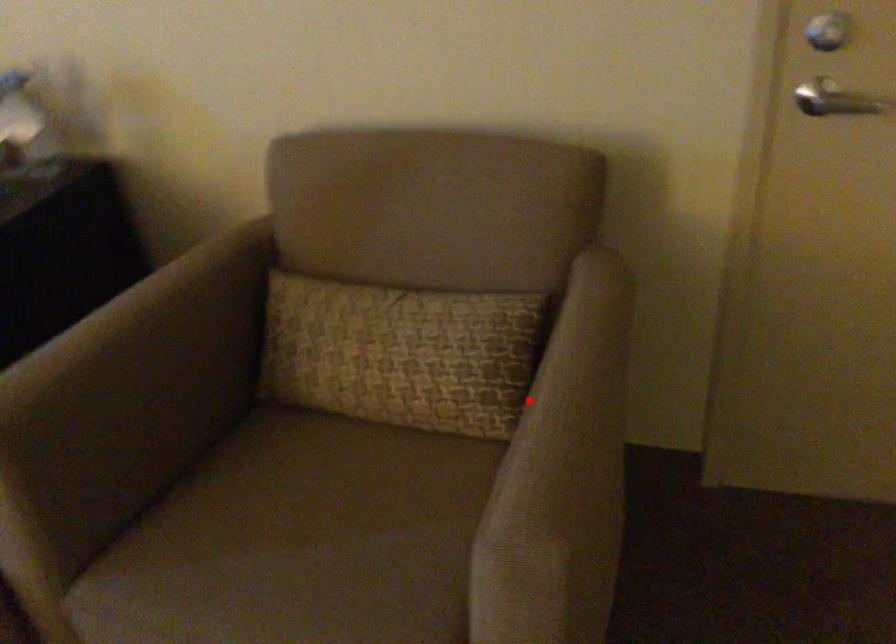
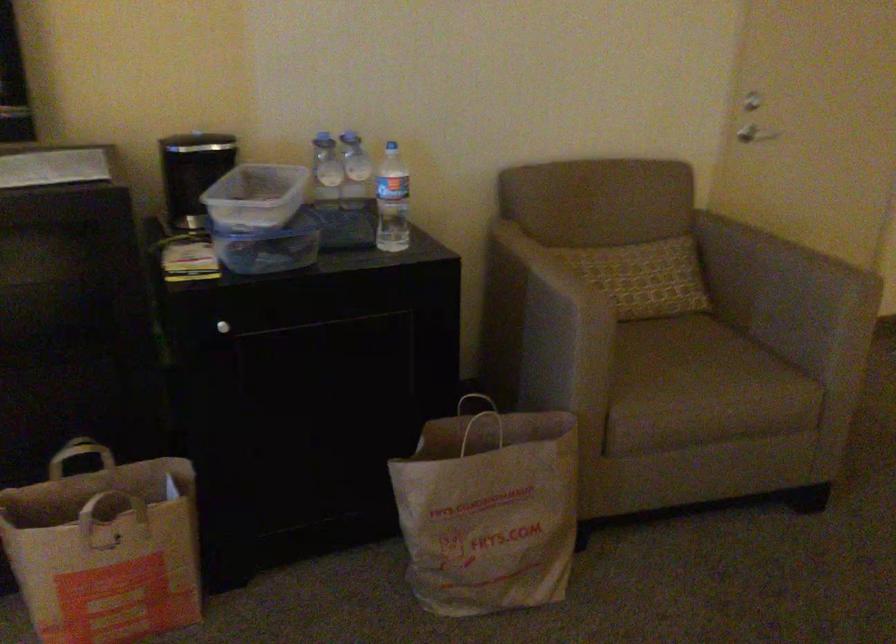
Question: I am providing you with two images of the same scene from different viewpoints. Image1 has a red point marked. In image2, the corresponding 3D location appears at what relative position? Reply with the corresponding letter.

Choices:
 (A) Closer
 (B) Farther

Answer: (B)